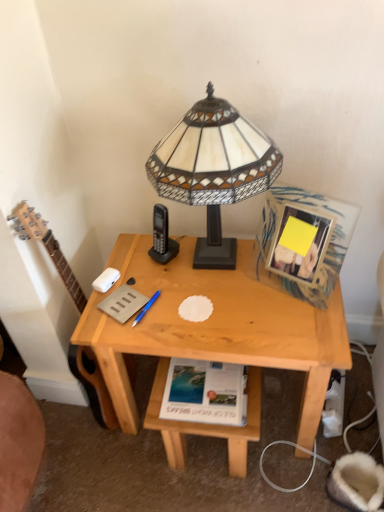
Find the location of `vacant space in stained glass lampshade at center (from a real-world perspective)`. vacant space in stained glass lampshade at center (from a real-world perspective) is located at coordinates (220, 263).